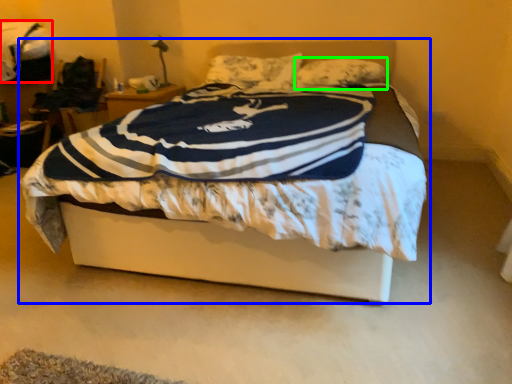
Question: Considering the real-world distances, which object is farthest from blanket (highlighted by a red box)? bed (highlighted by a blue box) or pillow (highlighted by a green box)?

Choices:
 (A) bed
 (B) pillow

Answer: (A)